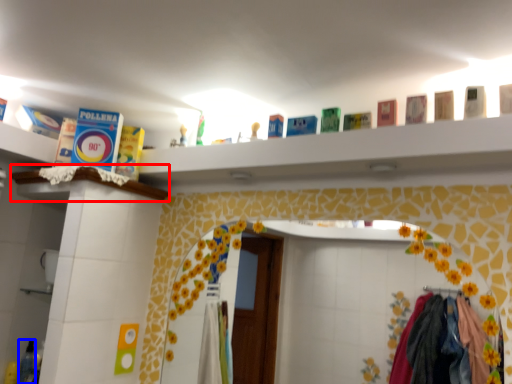
Question: Which object is closer to the camera taking this photo, ledge (highlighted by a red box) or toiletry (highlighted by a blue box)?

Choices:
 (A) ledge
 (B) toiletry

Answer: (A)